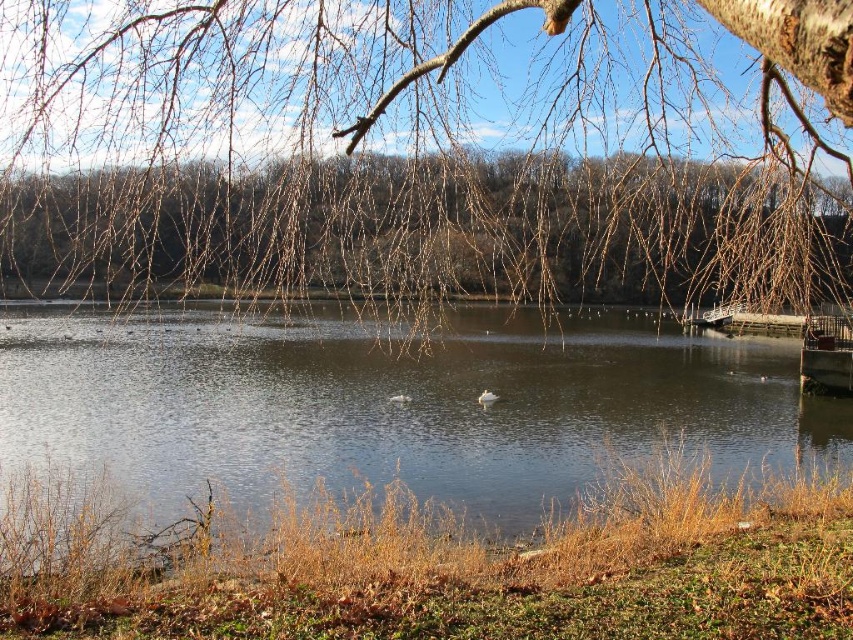
Does brown/dry branches at upper center appear under clear water at center?

Actually, brown/dry branches at upper center is above clear water at center.

Can you confirm if brown/dry branches at upper center is positioned above clear water at center?

Indeed, brown/dry branches at upper center is positioned over clear water at center.

Is point (653, 273) positioned before point (677, 358)?

Yes, it is.

You are a GUI agent. You are given a task and a screenshot of the screen. Output one action in this format:
    pyautogui.click(x=<x>, y=<y>)
    Task: Click on the brown/dry branches at upper center
    The image size is (853, 640).
    Given the screenshot: What is the action you would take?
    pyautogui.click(x=426, y=150)

Is brown/dry branches at upper center thinner than metallic red boat at lower right?

Incorrect, brown/dry branches at upper center's width is not less than metallic red boat at lower right's.

Is brown/dry branches at upper center below metallic red boat at lower right?

No.

Locate an element on the screen. brown/dry branches at upper center is located at coordinates (426, 150).

This screenshot has height=640, width=853. Describe the element at coordinates (396, 404) in the screenshot. I see `clear water at center` at that location.

Who is positioned more to the right, clear water at center or metallic red boat at lower right?

metallic red boat at lower right is more to the right.

Which is behind, point (781, 340) or point (815, 372)?

The point (781, 340) is more distant.

Find the location of `clear water at center`. clear water at center is located at coordinates (396, 404).